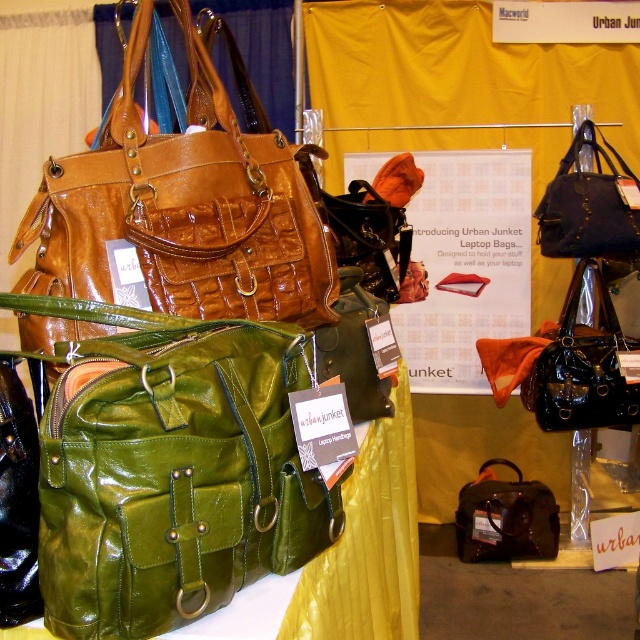
You are at the trade show and want to take a photo of the two points marked in the scene. Which point, point (227,486) or point (573,230), will appear larger in your photo?

Point (227,486) is closer to the camera than point (573,230), so it will appear larger in the photo.

You are a customer at the Urban Junket trade show booth. You want to pick up the green leather bag at center and the matte black bag at upper right to compare them. Can you reach both bags without moving your position?

The distance between the green leather bag at center and the matte black bag at upper right is 7.19 feet. Since the distance is quite large, you might need to move your position to reach both bags comfortably.